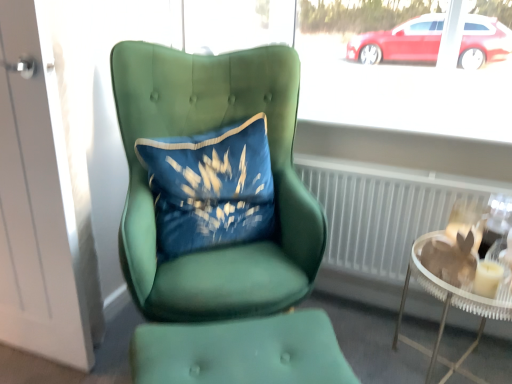
Image resolution: width=512 pixels, height=384 pixels. I want to click on free area below clear glass table at lower right (from a real-world perspective), so click(x=440, y=364).